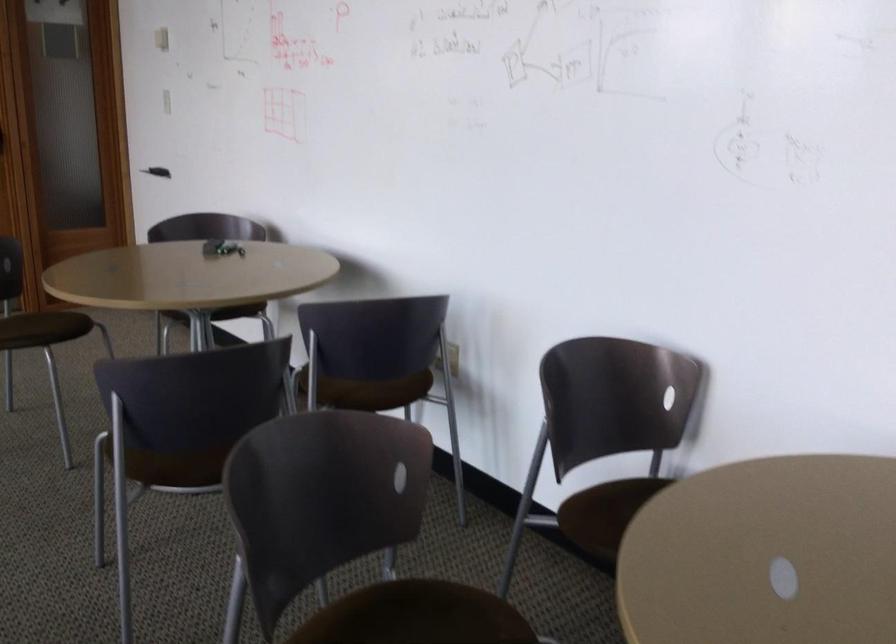
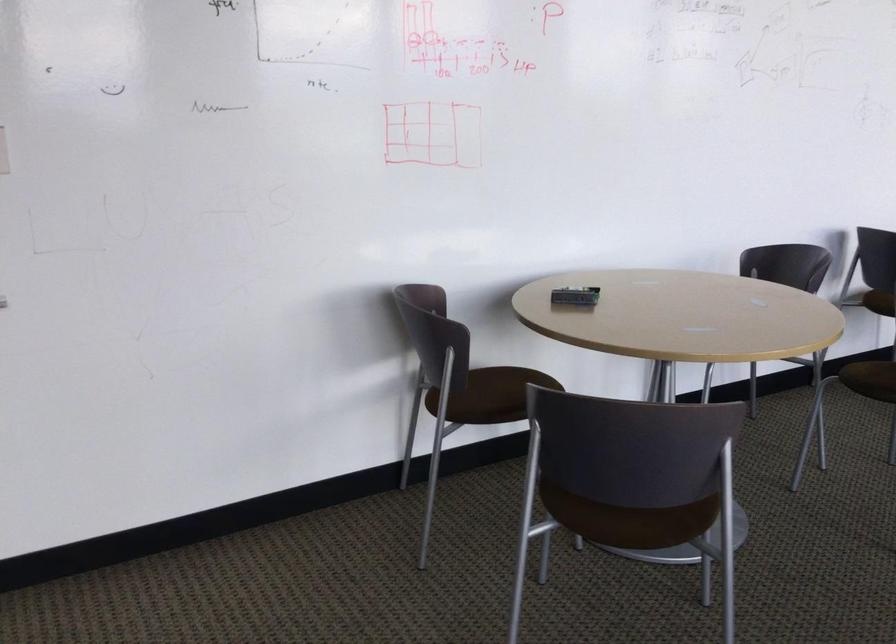
Question: I am providing you with two images of the same scene from different viewpoints. Please identify which objects are invisible in image2.

Choices:
 (A) brown chair sitting surface
 (B) whiteboard eraser
 (C) chair sitting surface
 (D) package of wipes

Answer: (A)